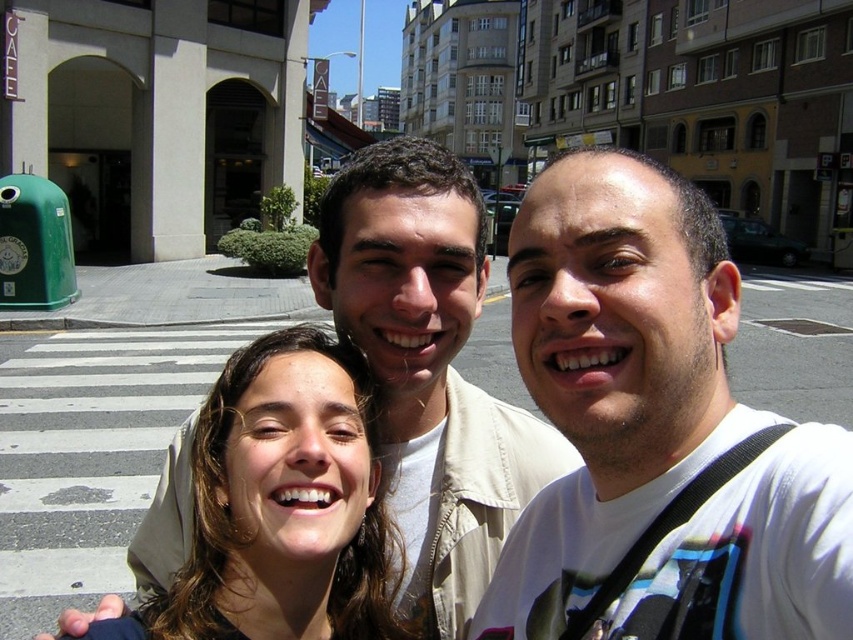
Question: Can you confirm if white matte shirt at center is smaller than brown hair at center?

Choices:
 (A) yes
 (B) no

Answer: (B)

Question: Is white matte shirt at center smaller than brown hair at center?

Choices:
 (A) yes
 (B) no

Answer: (B)

Question: Which object appears closest to the camera in this image?

Choices:
 (A) brown hair at center
 (B) white matte shirt at center

Answer: (B)

Question: Which object is farther from the camera taking this photo?

Choices:
 (A) white matte shirt at center
 (B) brown hair at center

Answer: (B)

Question: Which of the following is the closest to the observer?

Choices:
 (A) white matte shirt at center
 (B) brown hair at center

Answer: (A)

Question: Does white matte shirt at center have a lesser width compared to brown hair at center?

Choices:
 (A) no
 (B) yes

Answer: (B)